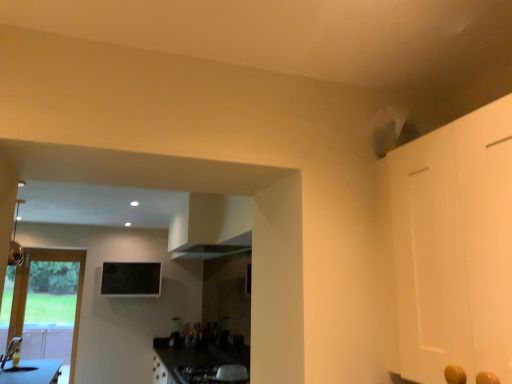
Question: Considering the positions of point (211, 370) and point (62, 362), is point (211, 370) closer or farther from the camera than point (62, 362)?

Choices:
 (A) closer
 (B) farther

Answer: (A)

Question: Considering the positions of metallic silver gas stove at lower center and wooden door at left in the image, is metallic silver gas stove at lower center wider or thinner than wooden door at left?

Choices:
 (A) thin
 (B) wide

Answer: (B)

Question: Which is farther from the wooden door at left?

Choices:
 (A) metallic silver gas stove at lower center
 (B) black glass window screen at upper center

Answer: (A)

Question: Which of these objects is positioned closest to the wooden door at left?

Choices:
 (A) black glass window screen at upper center
 (B) metallic silver gas stove at lower center

Answer: (A)